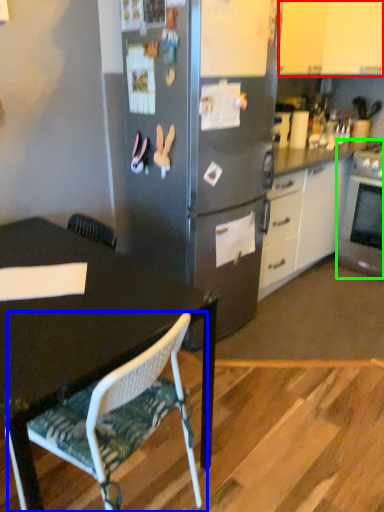
Question: Which object is positioned closest to cabinetry (highlighted by a red box)? Select from chair (highlighted by a blue box) and oven (highlighted by a green box).

Choices:
 (A) chair
 (B) oven

Answer: (B)